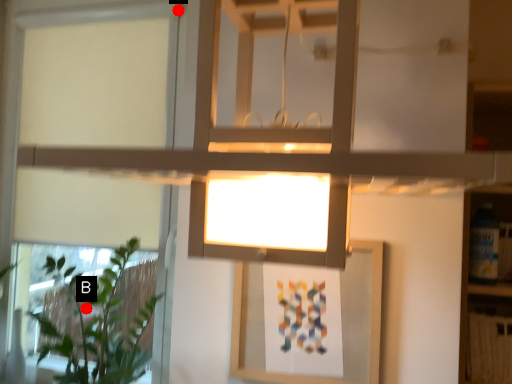
Question: Two points are circled on the image, labeled by A and B beside each circle. Which of the following is the farthest from the observer?

Choices:
 (A) A is further
 (B) B is further

Answer: (B)